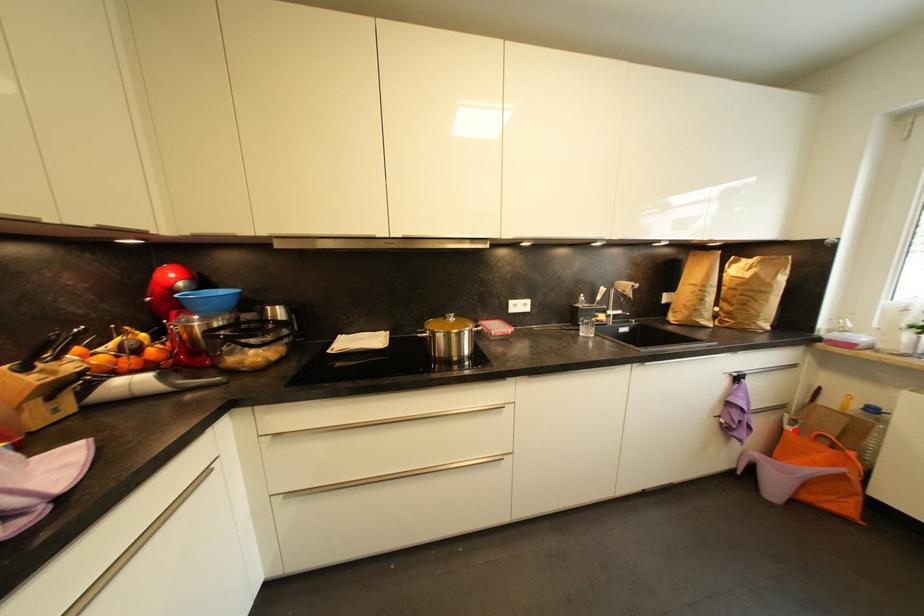
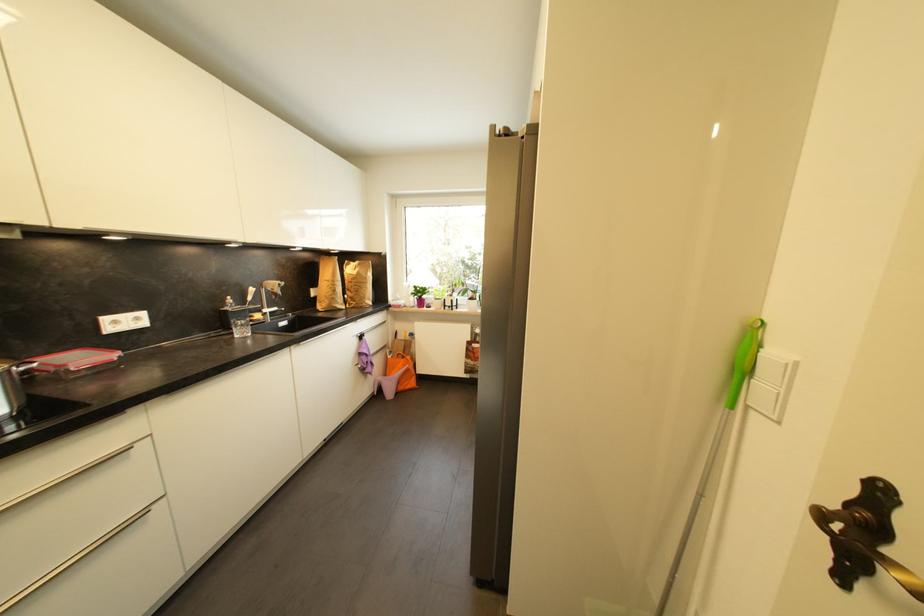
Find the pixel in the second image that matches the highlighted location in the first image.

(395, 359)